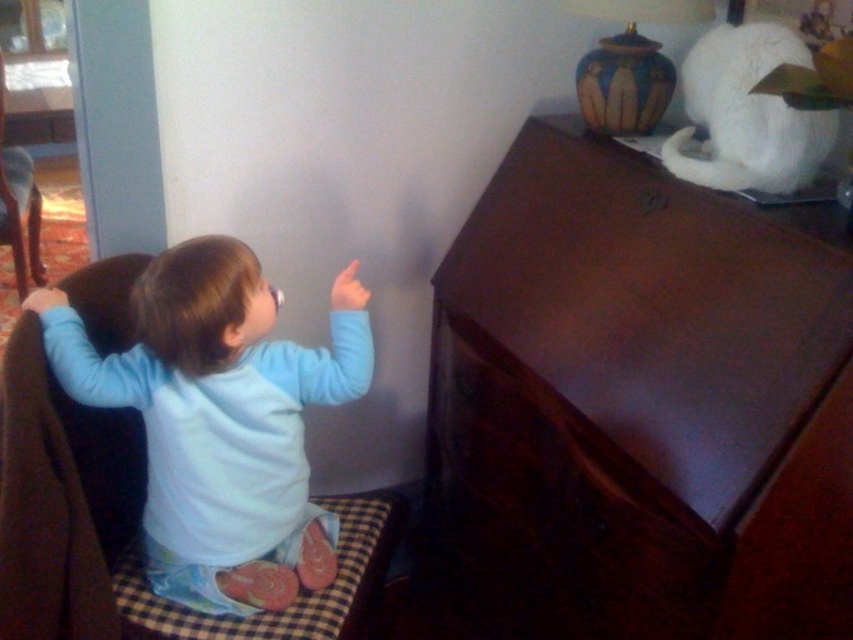
Question: Can you confirm if light blue fabric at upper left is bigger than dark wood drawer at center?

Choices:
 (A) no
 (B) yes

Answer: (A)

Question: Is dark wood dresser at upper right wider than dark wood drawer at center?

Choices:
 (A) yes
 (B) no

Answer: (A)

Question: Based on their relative distances, which object is farther from the light blue fabric at upper left?

Choices:
 (A) dark wood dresser at upper right
 (B) dark wood drawer at center

Answer: (A)

Question: Among these objects, which one is nearest to the camera?

Choices:
 (A) light blue fabric at upper left
 (B) dark wood drawer at center
 (C) dark wood dresser at upper right

Answer: (C)

Question: Considering the relative positions of dark wood dresser at upper right and light blue fabric at upper left in the image provided, where is dark wood dresser at upper right located with respect to light blue fabric at upper left?

Choices:
 (A) above
 (B) below

Answer: (B)

Question: Which object appears farthest from the camera in this image?

Choices:
 (A) dark wood drawer at center
 (B) dark wood dresser at upper right

Answer: (A)